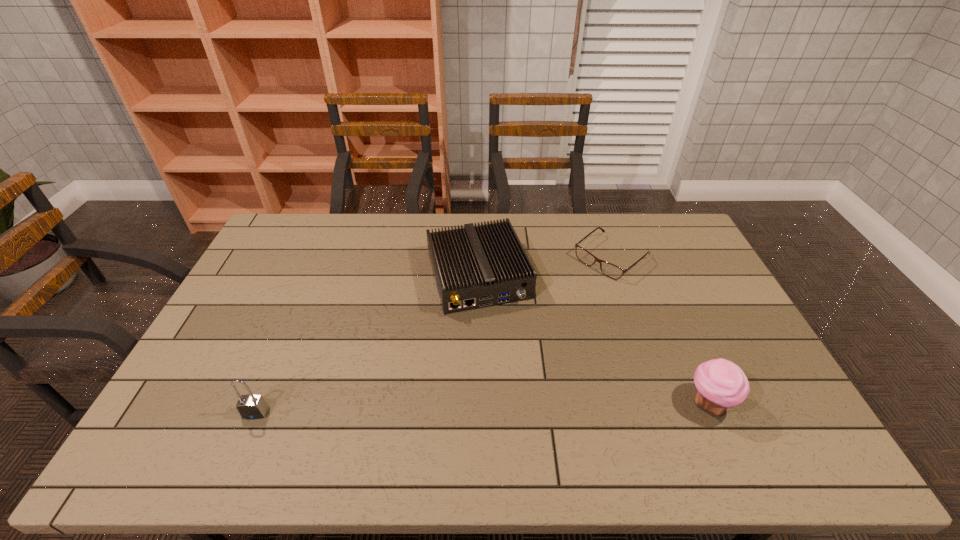
Where is `free region located 0.210m on the lenses of the spectacles`? The height and width of the screenshot is (540, 960). free region located 0.210m on the lenses of the spectacles is located at coordinates click(x=551, y=307).

I want to click on free space located on the lenses of the spectacles, so click(x=513, y=338).

Where is `router at the far edge`? This screenshot has width=960, height=540. router at the far edge is located at coordinates 479,266.

Where is `spectacles that is at the far edge`? The width and height of the screenshot is (960, 540). spectacles that is at the far edge is located at coordinates (610, 270).

Identify the location of padlock located in the near edge section of the desktop. (250, 406).

This screenshot has width=960, height=540. Find the location of `cupcake that is at the near edge`. cupcake that is at the near edge is located at coordinates [x=721, y=384].

The image size is (960, 540). In order to click on object positioned at the right edge in this screenshot , I will do `click(721, 384)`.

This screenshot has width=960, height=540. I want to click on object that is positioned at the near right corner, so (721, 384).

In the image, there is a desktop. At what (x,y) coordinates should I click in order to perform the action: click on vacant space at the far edge. Please return your answer as a coordinate pair (x, y). Looking at the image, I should click on (556, 231).

The image size is (960, 540). What are the coordinates of `vacant region at the near edge of the desktop` in the screenshot? It's located at (679, 409).